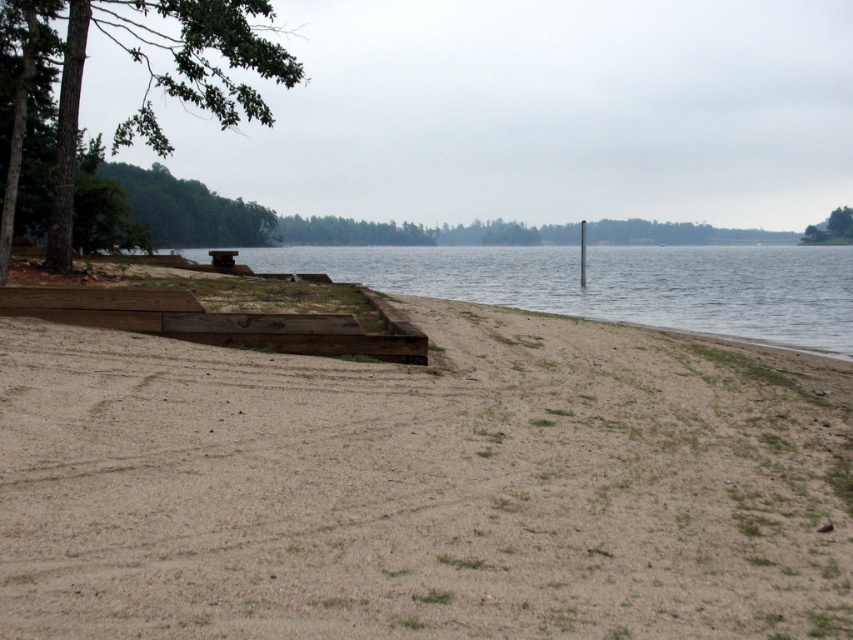
You are standing on the sandy beach and want to cross to the other side of the clear water at center. The smooth gray pole at right is in your path. Can you step over the pole without getting wet?

The clear water at center has a greater height compared to the smooth gray pole at right, so the pole is shorter than the water. Therefore, stepping over the pole might not keep you dry since the water is deeper there.

Consider the image. You are a photographer planning to take a landscape photo of the serene lakeside scene. You want to ensure the green leafy tree at upper right is positioned exactly at the top right corner of your photo. Given the 2D coordinates provided, would the tree be centered or placed at the corner?

The green leafy tree at upper right is located at coordinates 0.358 on the x and 0.975 on the y axis, which places it near the top right corner of the image. Since 0.975 is very close to 1.0 on the y axis, it would be positioned at the top right corner rather than centered.

You are standing on the brown sandy beach at lower left and want to reach the clear water at center. Based on their widths, which area is narrower and might require careful walking?

The brown sandy beach at lower left has a lesser width compared to the clear water at center, so the beach is narrower and might require careful walking to avoid slipping into the water.